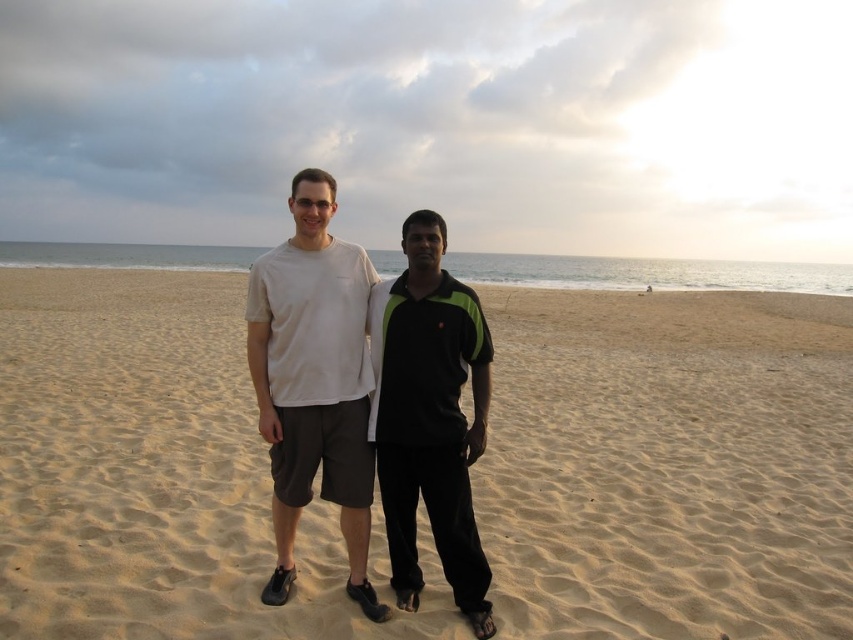
You are a photographer trying to capture a photo of the sandy yellow sand at center and the black matte shirt at center. If your camera has a maximum focus range of 15 feet, will you be able to capture both subjects in focus without moving the camera?

The sandy yellow sand at center and black matte shirt at center are 18.20 feet apart from each other, which exceeds the camera maximum focus range of 15 feet. Therefore, you will not be able to capture both subjects in focus without moving the camera.